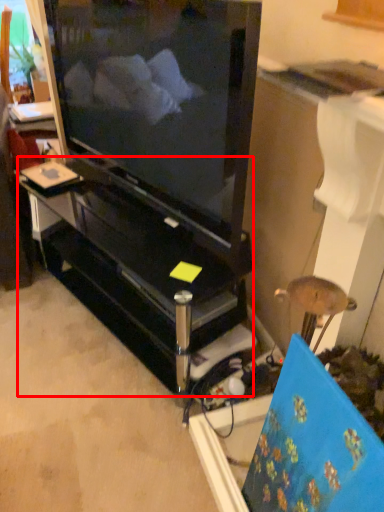
Question: From the image, what is the correct spatial relationship of furniture (annotated by the red box) in relation to television?

Choices:
 (A) left
 (B) right

Answer: (A)